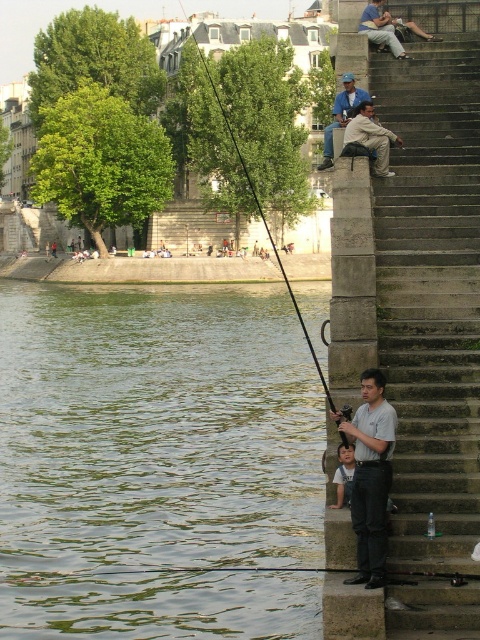
You are a photographer trying to capture a shot of the greenish water at lower left and the concrete stairs at right. Since you want to ensure both are visible in your photo, which object should you focus on first to get the best composition?

The greenish water at lower left is not as tall as the concrete stairs at right, so you should focus on the concrete stairs at right first to ensure both objects are in frame.

You are standing at the point labeled point (344, 76) and want to walk to the point labeled point (403, 532). Which direction should you move in to reach your destination?

You should move forward because point (403, 532) is in front of point (344, 76).

Based on the photo, you are a photographer trying to capture the man and the child in the scene. Since you want to include both the concrete stairs at right and the gray cotton shirt at lower right in the frame, which object should you focus on to ensure both are visible?

The concrete stairs at right is much taller than the gray cotton shirt at lower right, so focusing on the taller concrete stairs at right will help ensure both objects are visible in the frame.